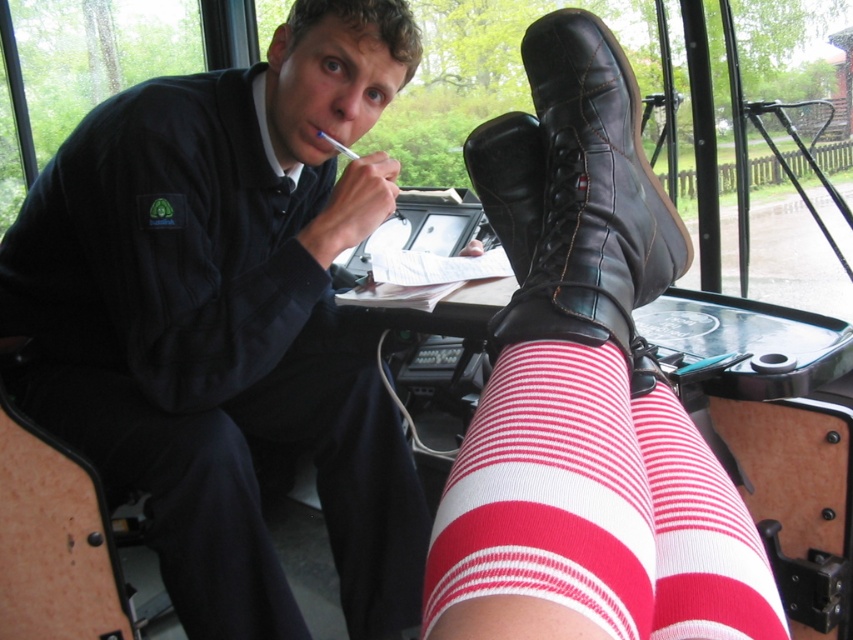
Question: Can you confirm if red striped sock at lower center is positioned to the left of white striped sock at lower center?

Choices:
 (A) no
 (B) yes

Answer: (B)

Question: Does red striped sock at lower center appear under white striped sock at lower center?

Choices:
 (A) yes
 (B) no

Answer: (B)

Question: Estimate the real-world distances between objects in this image. Which object is closer to the red striped sock at lower center?

Choices:
 (A) matte black shirt at center
 (B) leather boots at center
 (C) white striped sock at lower center
 (D) red striped tights at lower right

Answer: (C)

Question: Is matte black shirt at center positioned behind red striped sock at lower center?

Choices:
 (A) yes
 (B) no

Answer: (A)

Question: Among these objects, which one is nearest to the camera?

Choices:
 (A) white striped sock at lower center
 (B) leather boots at center
 (C) red striped sock at lower center
 (D) red striped tights at lower right

Answer: (C)

Question: Based on their relative distances, which object is farther from the red striped tights at lower right?

Choices:
 (A) red striped sock at lower center
 (B) white striped sock at lower center
 (C) leather boots at center
 (D) matte black shirt at center

Answer: (B)